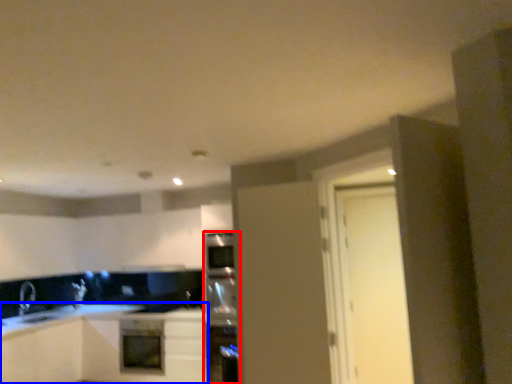
Question: Which object is closer to the camera taking this photo, appliance (highlighted by a red box) or cabinetry (highlighted by a blue box)?

Choices:
 (A) appliance
 (B) cabinetry

Answer: (A)